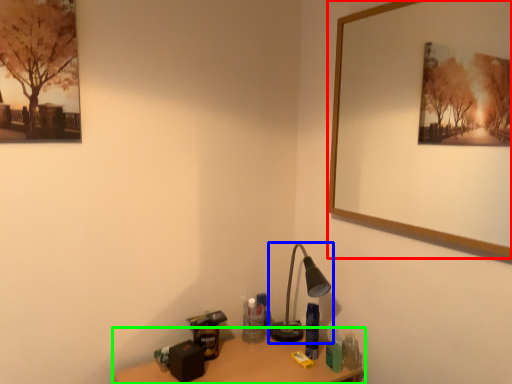
Question: Estimate the real-world distances between objects in this image. Which object is farther from picture frame (highlighted by a red box), lamp (highlighted by a blue box) or table (highlighted by a green box)?

Choices:
 (A) lamp
 (B) table

Answer: (B)